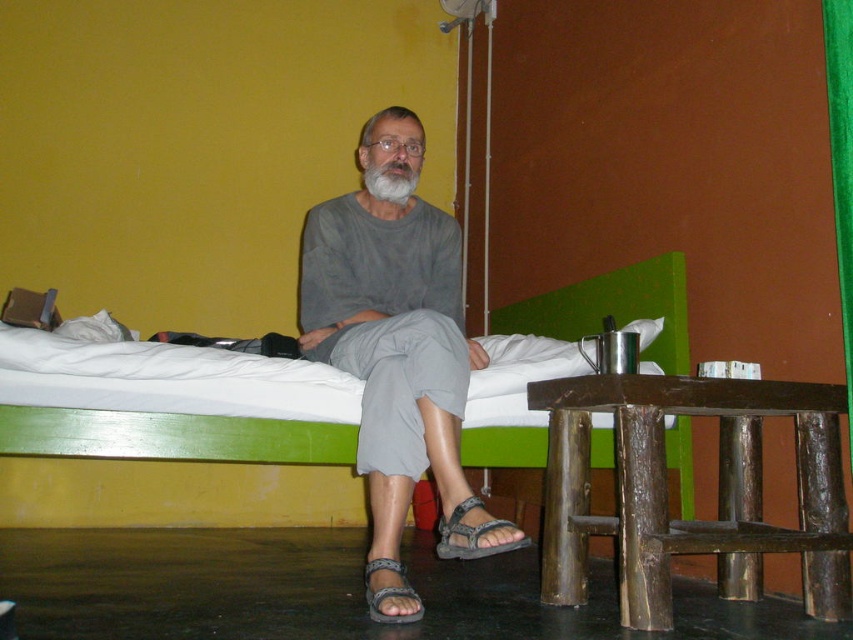
Question: Which object is closer to the camera taking this photo?

Choices:
 (A) brown wooden stool at lower right
 (B) white fabric bed at center
 (C) brown woven sandal at lower center
 (D) gray cotton shirt at center

Answer: (D)

Question: Considering the real-world distances, which object is farthest from the gray fabric sandal at lower center?

Choices:
 (A) white fabric bed at center
 (B) brown wooden stool at lower right
 (C) green velvet curtain at right
 (D) brown woven sandal at lower center

Answer: (C)

Question: Which point is farther to the camera?

Choices:
 (A) white fabric bed at center
 (B) green velvet curtain at right
 (C) gray cotton shirt at center

Answer: (A)

Question: Is green velvet curtain at right wider than gray matte beard at center?

Choices:
 (A) yes
 (B) no

Answer: (B)

Question: Is white fabric bed at center positioned in front of gray cotton shirt at center?

Choices:
 (A) yes
 (B) no

Answer: (B)

Question: Is gray matte beard at center closer to camera compared to brown woven sandal at lower center?

Choices:
 (A) no
 (B) yes

Answer: (A)